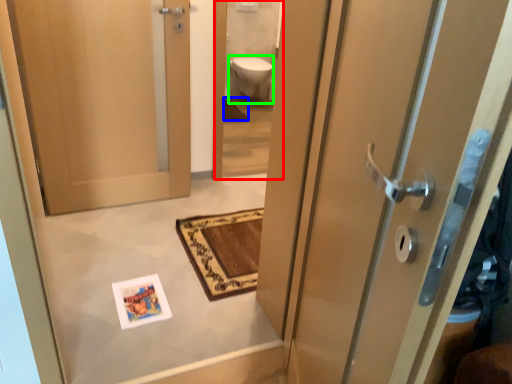
Question: Which object is positioned closest to mirror (highlighted by a red box)? Select from bath mat (highlighted by a blue box) and toilet bowl (highlighted by a green box).

Choices:
 (A) bath mat
 (B) toilet bowl

Answer: (B)